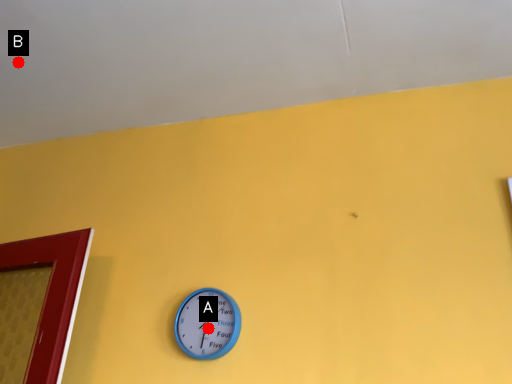
Question: Two points are circled on the image, labeled by A and B beside each circle. Among these points, which one is farthest from the camera?

Choices:
 (A) A is further
 (B) B is further

Answer: (B)